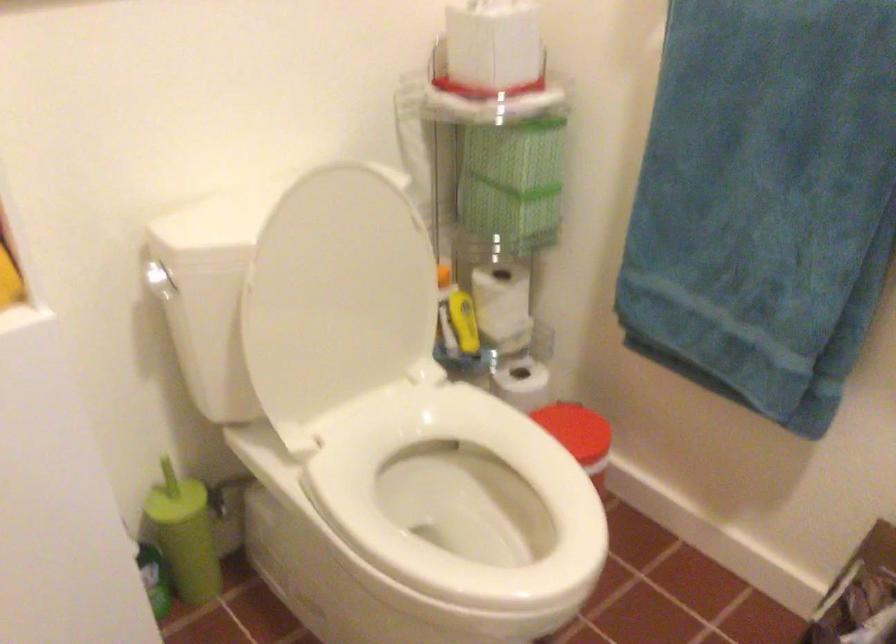
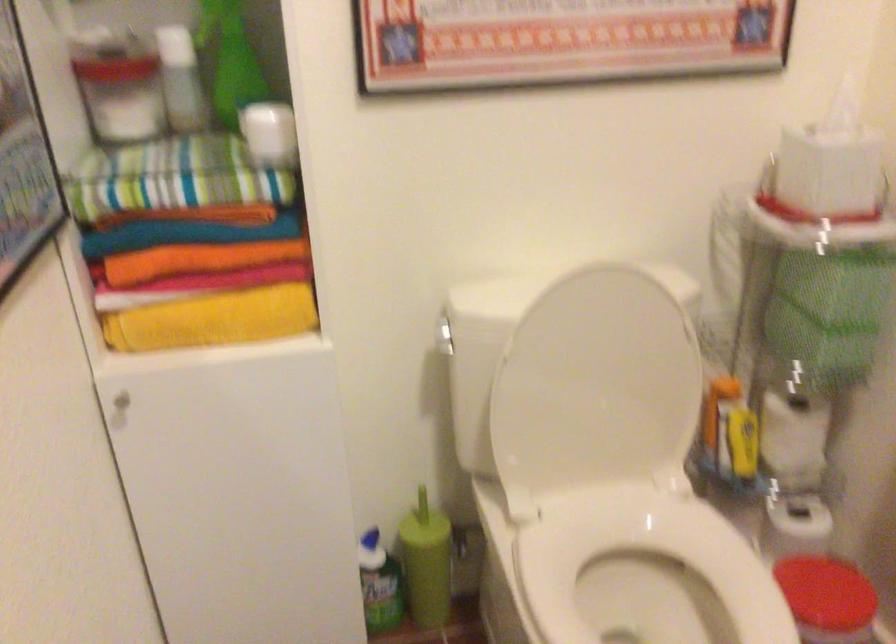
Locate, in the second image, the point that corresponds to (x=567, y=429) in the first image.

(824, 591)